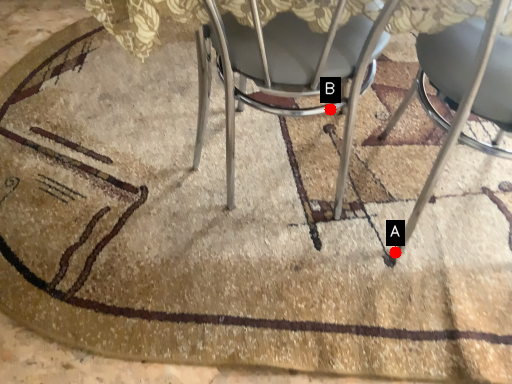
Question: Two points are circled on the image, labeled by A and B beside each circle. Which point is farther to the camera?

Choices:
 (A) A is further
 (B) B is further

Answer: (B)